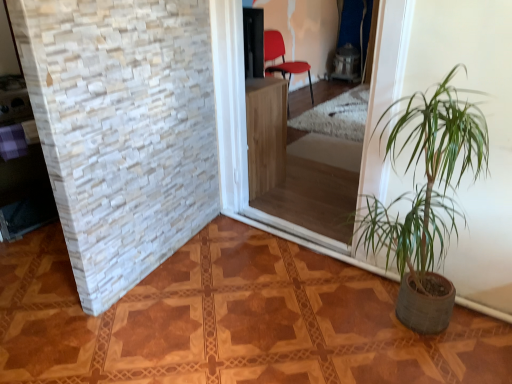
What do you see at coordinates (283, 59) in the screenshot?
I see `matte red chair at center` at bounding box center [283, 59].

In order to click on matte red chair at center in this screenshot , I will do tap(283, 59).

The height and width of the screenshot is (384, 512). In order to click on matte red chair at center in this screenshot , I will do `click(283, 59)`.